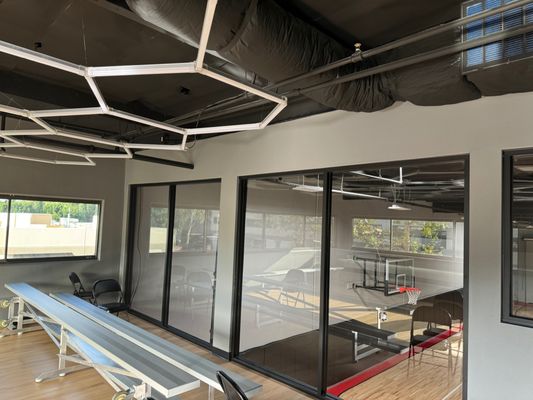
In order to click on window in this screenshot , I will do `click(56, 241)`.